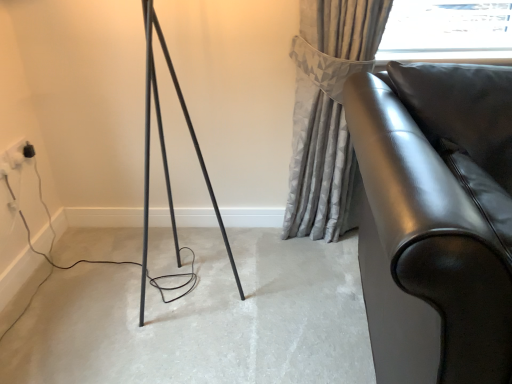
Describe the element at coordinates (16, 153) in the screenshot. I see `black plastic outlet at lower left` at that location.

Measure the distance between point (311, 116) and camera.

Point (311, 116) is 5.63 feet from camera.

Identify the location of black plastic outlet at lower left. The image size is (512, 384). (16, 153).

From the image's perspective, relative to matte black floor at center, is black plastic outlet at lower left above or below?

Clearly, from the image's perspective, black plastic outlet at lower left is above matte black floor at center.

Does point (24, 156) lie in front of point (227, 360)?

No, it is behind (227, 360).

Considering the relative sizes of black plastic outlet at lower left and matte black floor at center in the image provided, is black plastic outlet at lower left taller than matte black floor at center?

Yes, black plastic outlet at lower left is taller than matte black floor at center.

Is black plastic outlet at lower left next to matte black floor at center?

No, black plastic outlet at lower left is not next to matte black floor at center.

Considering the sizes of objects gray textured curtain at upper right and matte black floor at center in the image provided, who is taller, gray textured curtain at upper right or matte black floor at center?

gray textured curtain at upper right is taller.

From the picture: From the image's perspective, does gray textured curtain at upper right appear lower than matte black floor at center?

No.

Is glossy leather sofa at right to the left of gray textured curtain at upper right from the viewer's perspective?

Incorrect, glossy leather sofa at right is not on the left side of gray textured curtain at upper right.

Is glossy leather sofa at right not near gray textured curtain at upper right?

No, glossy leather sofa at right is not far from gray textured curtain at upper right.

From the image's perspective, would you say glossy leather sofa at right is shown under gray textured curtain at upper right?

Yes.

How much distance is there between glossy leather sofa at right and gray textured curtain at upper right?

They are 21.40 inches apart.

Is glossy leather sofa at right aimed at matte black floor at center?

No, glossy leather sofa at right is not aimed at matte black floor at center.

From a real-world perspective, is glossy leather sofa at right positioned over matte black floor at center based on gravity?

Indeed, from a real-world perspective, glossy leather sofa at right stands above matte black floor at center.

Locate an element on the screen. This screenshot has height=384, width=512. concrete below the glossy leather sofa at right (from the image's perspective) is located at coordinates (203, 319).

Would you say glossy leather sofa at right is a long distance from black plastic outlet at lower left?

Indeed, glossy leather sofa at right is not near black plastic outlet at lower left.

Is glossy leather sofa at right aimed at black plastic outlet at lower left?

No.

Choose the correct answer: Is glossy leather sofa at right inside black plastic outlet at lower left or outside it?

glossy leather sofa at right cannot be found inside black plastic outlet at lower left.

Which point is more distant from viewer, (x=490, y=114) or (x=12, y=161)?

Point (x=12, y=161)

From the image's perspective, who appears lower, matte black floor at center or gray textured curtain at upper right?

matte black floor at center, from the image's perspective.

Does matte black floor at center have a greater height compared to gray textured curtain at upper right?

Incorrect, the height of matte black floor at center is not larger of that of gray textured curtain at upper right.

How different are the orientations of matte black floor at center and gray textured curtain at upper right in degrees?

They differ by 4.41e-05 degrees in their facing directions.

Is matte black floor at center with gray textured curtain at upper right?

matte black floor at center is not next to gray textured curtain at upper right, and they're not touching.

How much distance is there between black plastic outlet at lower left and gray textured curtain at upper right?

black plastic outlet at lower left is 1.30 meters away from gray textured curtain at upper right.

Considering the points (19, 145) and (323, 42), which point is behind, point (19, 145) or point (323, 42)?

Point (19, 145)

Who is bigger, black plastic outlet at lower left or gray textured curtain at upper right?

gray textured curtain at upper right.

Is black plastic outlet at lower left with gray textured curtain at upper right?

No, black plastic outlet at lower left is not beside gray textured curtain at upper right.

In the image, there is a black plastic outlet at lower left. Where is `concrete below it (from a real-world perspective)`? The width and height of the screenshot is (512, 384). concrete below it (from a real-world perspective) is located at coordinates click(x=203, y=319).

At what (x,y) coordinates should I click in order to perform the action: click on concrete located on the left of gray textured curtain at upper right. Please return your answer as a coordinate pair (x, y). Looking at the image, I should click on (203, 319).

When comparing their distances from gray textured curtain at upper right, does matte black floor at center or glossy leather sofa at right seem further?

matte black floor at center is further to gray textured curtain at upper right.

Estimate the real-world distances between objects in this image. Which object is further from gray textured curtain at upper right, black plastic outlet at lower left or matte black floor at center?

Among the two, black plastic outlet at lower left is located further to gray textured curtain at upper right.

From the image, which object appears to be farther from gray textured curtain at upper right, matte black floor at center or black plastic outlet at lower left?

black plastic outlet at lower left is positioned further to the anchor gray textured curtain at upper right.

Which object lies further to the anchor point matte black floor at center, gray textured curtain at upper right or black plastic outlet at lower left?

The object further to matte black floor at center is black plastic outlet at lower left.

Considering their positions, is matte black floor at center positioned further to glossy leather sofa at right than gray textured curtain at upper right?

The object further to glossy leather sofa at right is matte black floor at center.

In the scene shown: Looking at the image, which one is located closer to black plastic outlet at lower left, matte black floor at center or glossy leather sofa at right?

matte black floor at center is closer to black plastic outlet at lower left.

From the image, which object appears to be farther from matte black floor at center, black plastic outlet at lower left or gray textured curtain at upper right?

black plastic outlet at lower left lies further to matte black floor at center than the other object.

Estimate the real-world distances between objects in this image. Which object is further from black plastic outlet at lower left, gray textured curtain at upper right or glossy leather sofa at right?

glossy leather sofa at right.

Locate an element on the screen. Image resolution: width=512 pixels, height=384 pixels. concrete between black plastic outlet at lower left and gray textured curtain at upper right from left to right is located at coordinates (203, 319).

Find the location of a particular element. concrete between glossy leather sofa at right and gray textured curtain at upper right along the z-axis is located at coordinates (203, 319).

Find the location of `curtain between black plastic outlet at lower left and glossy leather sofa at right from left to right`. curtain between black plastic outlet at lower left and glossy leather sofa at right from left to right is located at coordinates (328, 113).

The width and height of the screenshot is (512, 384). Find the location of `concrete between black plastic outlet at lower left and glossy leather sofa at right`. concrete between black plastic outlet at lower left and glossy leather sofa at right is located at coordinates click(x=203, y=319).